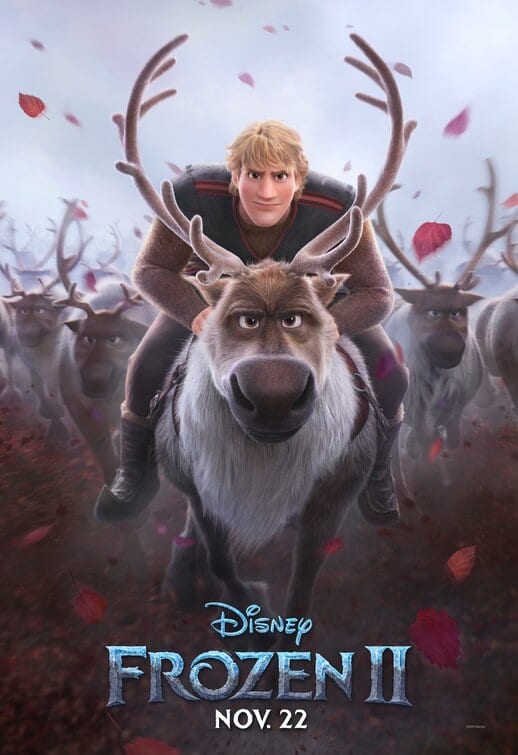
Image resolution: width=518 pixels, height=755 pixels. I want to click on (rein)deer head, so click(30, 307), click(107, 324), click(275, 297), click(437, 310).